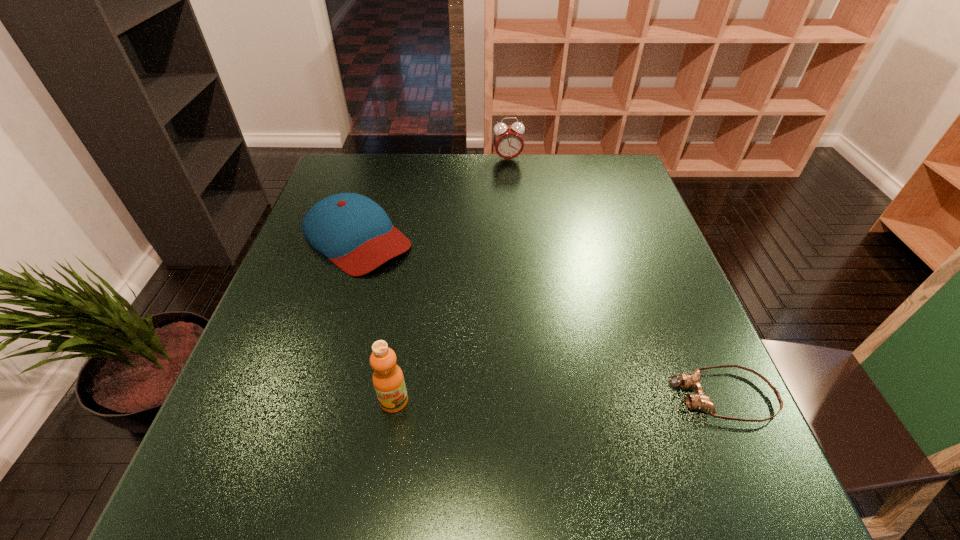
Where is `orange juice`? orange juice is located at coordinates (388, 380).

At what (x,y) coordinates should I click in order to perform the action: click on the rightmost object. Please return your answer as a coordinate pair (x, y). This screenshot has width=960, height=540. Looking at the image, I should click on (700, 401).

Identify the location of the shortest object. (700, 401).

This screenshot has width=960, height=540. I want to click on the farthest object, so click(508, 141).

Locate an element on the screen. The width and height of the screenshot is (960, 540). the second object from right to left is located at coordinates (508, 141).

You are a GUI agent. You are given a task and a screenshot of the screen. Output one action in this format:
    pyautogui.click(x=<x>, y=<y>)
    Task: Click on the second farthest object
    
    Given the screenshot: What is the action you would take?
    pos(354,232)

This screenshot has height=540, width=960. What are the coordinates of `the third tallest object` in the screenshot? It's located at (354, 232).

The image size is (960, 540). I want to click on vacant space located 0.080m on the front lenses and sides of the goggles, so click(626, 396).

Locate an element on the screen. The height and width of the screenshot is (540, 960). vacant area located 0.400m on the front lenses and sides of the goggles is located at coordinates (453, 396).

Image resolution: width=960 pixels, height=540 pixels. In order to click on free spot located on the front lenses and sides of the goggles in this screenshot , I will do `click(594, 396)`.